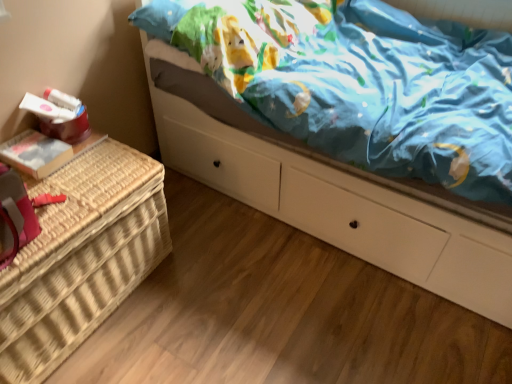
In order to click on spots to the right of woven wicker basket at left in this screenshot , I will do `click(215, 292)`.